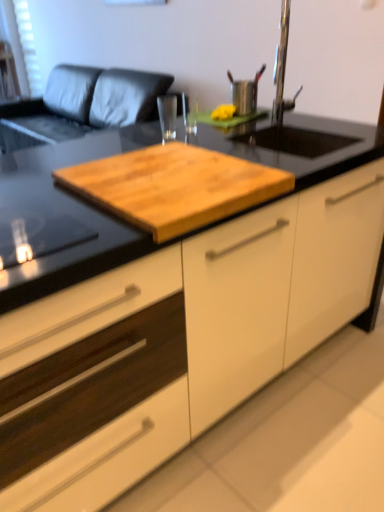
Question: Does metallic stainless steel cup at upper center have a larger size compared to white mesh screen at upper left?

Choices:
 (A) yes
 (B) no

Answer: (B)

Question: From a real-world perspective, is metallic stainless steel cup at upper center on top of white mesh screen at upper left?

Choices:
 (A) no
 (B) yes

Answer: (A)

Question: Considering the relative sizes of metallic stainless steel cup at upper center and white mesh screen at upper left in the image provided, is metallic stainless steel cup at upper center smaller than white mesh screen at upper left?

Choices:
 (A) no
 (B) yes

Answer: (B)

Question: From a real-world perspective, is metallic stainless steel cup at upper center positioned under white mesh screen at upper left based on gravity?

Choices:
 (A) no
 (B) yes

Answer: (B)

Question: Can you confirm if metallic stainless steel cup at upper center is taller than white mesh screen at upper left?

Choices:
 (A) yes
 (B) no

Answer: (B)

Question: Considering the relative positions of metallic stainless steel cup at upper center and white mesh screen at upper left in the image provided, is metallic stainless steel cup at upper center to the left of white mesh screen at upper left from the viewer's perspective?

Choices:
 (A) yes
 (B) no

Answer: (B)

Question: Can we say natural wood cutting board at center lies outside leather couch at upper left?

Choices:
 (A) yes
 (B) no

Answer: (A)

Question: From a real-world perspective, is natural wood cutting board at center under leather couch at upper left?

Choices:
 (A) yes
 (B) no

Answer: (B)

Question: Is natural wood cutting board at center surrounding leather couch at upper left?

Choices:
 (A) yes
 (B) no

Answer: (B)

Question: From a real-world perspective, is natural wood cutting board at center physically above leather couch at upper left?

Choices:
 (A) yes
 (B) no

Answer: (A)

Question: From the image's perspective, is natural wood cutting board at center below leather couch at upper left?

Choices:
 (A) yes
 (B) no

Answer: (A)

Question: Considering the relative sizes of natural wood cutting board at center and leather couch at upper left in the image provided, is natural wood cutting board at center wider than leather couch at upper left?

Choices:
 (A) no
 (B) yes

Answer: (A)

Question: Is the position of white mesh screen at upper left more distant than that of white matte cabinet at center?

Choices:
 (A) no
 (B) yes

Answer: (B)